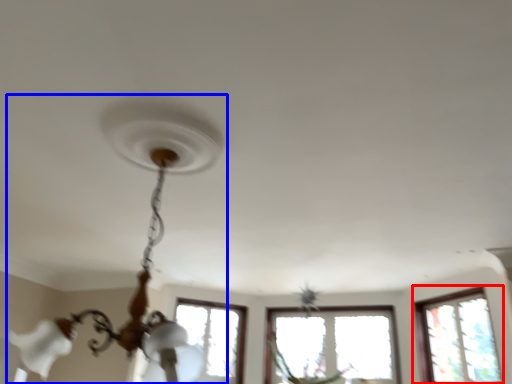
Question: Which point is further to the camera, window (highlighted by a red box) or lamp (highlighted by a blue box)?

Choices:
 (A) window
 (B) lamp

Answer: (A)